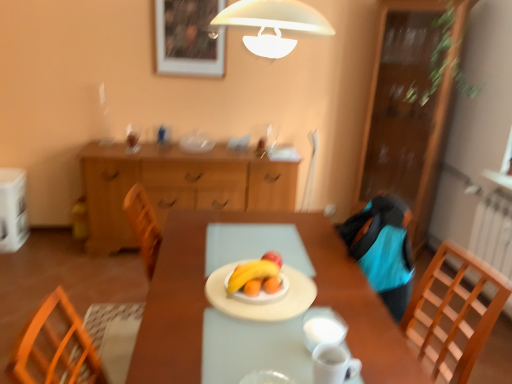
Question: Does point (358, 360) appear closer or farther from the camera than point (312, 347)?

Choices:
 (A) closer
 (B) farther

Answer: (B)

Question: In terms of width, does white glossy mug at lower center, which is the 2th tableware from front to back, look wider or thinner when compared to white glossy mug at center, which is counted as the second tableware, starting from the back?

Choices:
 (A) thin
 (B) wide

Answer: (A)

Question: Estimate the real-world distances between objects in this image. Which object is farther from the white matte plate at center, positioned as the 1th tableware in back-to-front order?

Choices:
 (A) wooden chair at right
 (B) wooden cabinet at right, acting as the 2th cabinetry starting from the left
 (C) yellow matte banana at center
 (D) wooden picture frame at upper center
 (E) white plastic bag at left

Answer: (E)

Question: Which of these objects is positioned closest to the wooden chair at right?

Choices:
 (A) wooden table at center
 (B) shiny red apple at center
 (C) white glossy mug at center, which ranks as the 3th tableware in front-to-back order
 (D) white fabric armchair at upper center
 (E) white glossy cup at center, which is counted as the first tableware, starting from the front

Answer: (A)